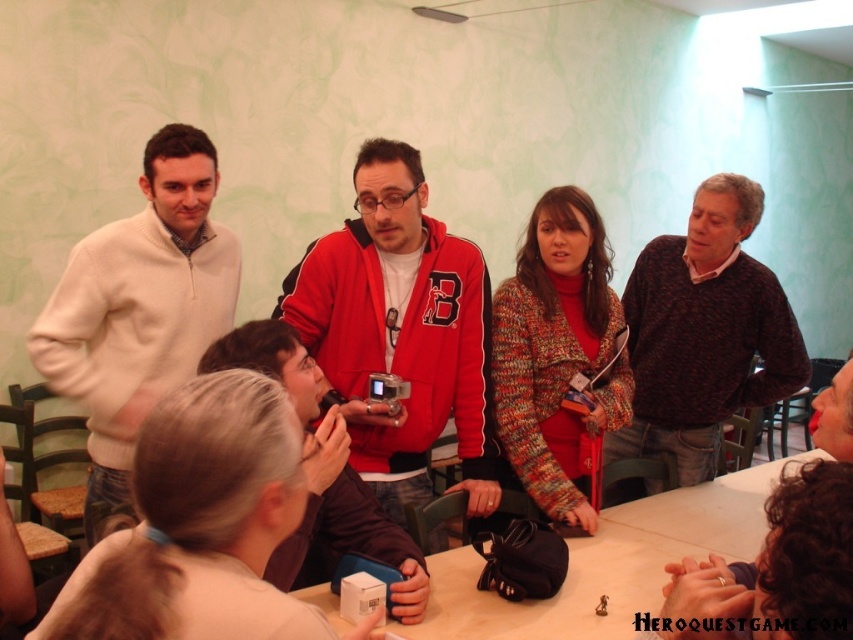
Based on the photo, you are organizing a clothing donation drive and need to categorize items by size. You have two items to sort out of the image provided. Which item is bigger in size between the red fleece jacket at center and the dark brown sweater at right?

The red fleece jacket at center has a larger size compared to the dark brown sweater at right, so the red fleece jacket at center is bigger in size.

You are a photographer standing 1 meter away from the camera. You want to take a photo of the white fleece sweater at left without moving the camera. Is it possible to capture the sweater in the frame?

The white fleece sweater at left is 1.22 meters away from the viewer. Since the photographer is only 1 meter away from the camera, they are closer to the camera than the sweater. This means the sweater is further away from the photographer than the camera, so it might be out of the camera frame unless the camera has a wide enough angle to include objects 0.22 meters beyond the photographer.

You are standing at the location of the person in the red hoodie with a large B logo. You want to hand a document to the person wearing the dark brown sweater at right. How many steps do you need to take to reach them?

The distance between the person in the red hoodie with a large B logo and the dark brown sweater at right is 8.16 feet. Assuming an average step length of 2.5 feet, you would need approximately 3 steps to reach them.